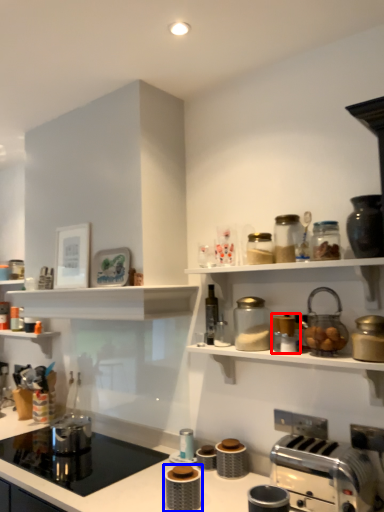
Question: Which object appears farthest to the camera in this image, appliance (highlighted by a red box) or appliance (highlighted by a blue box)?

Choices:
 (A) appliance
 (B) appliance

Answer: (A)